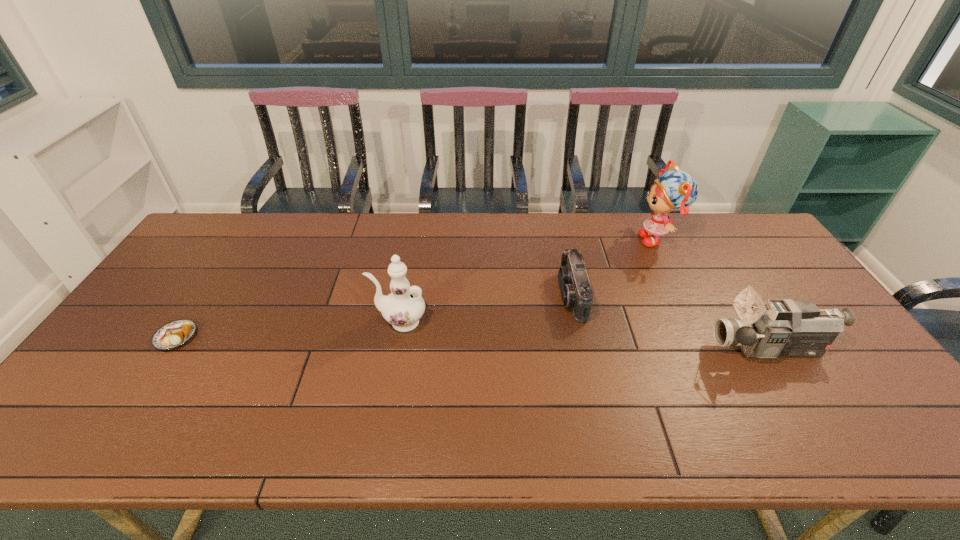
Locate an element on the screen. The image size is (960, 540). vacant area situated 0.370m on the back of the pastry is located at coordinates (240, 241).

Identify the location of object at the far edge. The height and width of the screenshot is (540, 960). (675, 190).

Where is `object present at the left edge`? This screenshot has width=960, height=540. object present at the left edge is located at coordinates (174, 334).

I want to click on object present at the right edge, so click(x=776, y=328).

The height and width of the screenshot is (540, 960). In the image, there is a desktop. Identify the location of vacant space at the far edge. (318, 238).

This screenshot has height=540, width=960. I want to click on vacant space at the left edge, so click(130, 340).

The height and width of the screenshot is (540, 960). What are the coordinates of `free spot at the right edge of the desktop` in the screenshot? It's located at (808, 299).

Identify the location of free area in between the chinaware and the leftmost object. Image resolution: width=960 pixels, height=540 pixels. (288, 329).

Where is `free space between the doll and the chinaware`? This screenshot has width=960, height=540. free space between the doll and the chinaware is located at coordinates (529, 280).

At what (x,y) coordinates should I click in order to perform the action: click on free point between the shorter camcorder and the shortest object. Please return your answer as a coordinate pair (x, y). Image resolution: width=960 pixels, height=540 pixels. Looking at the image, I should click on (374, 316).